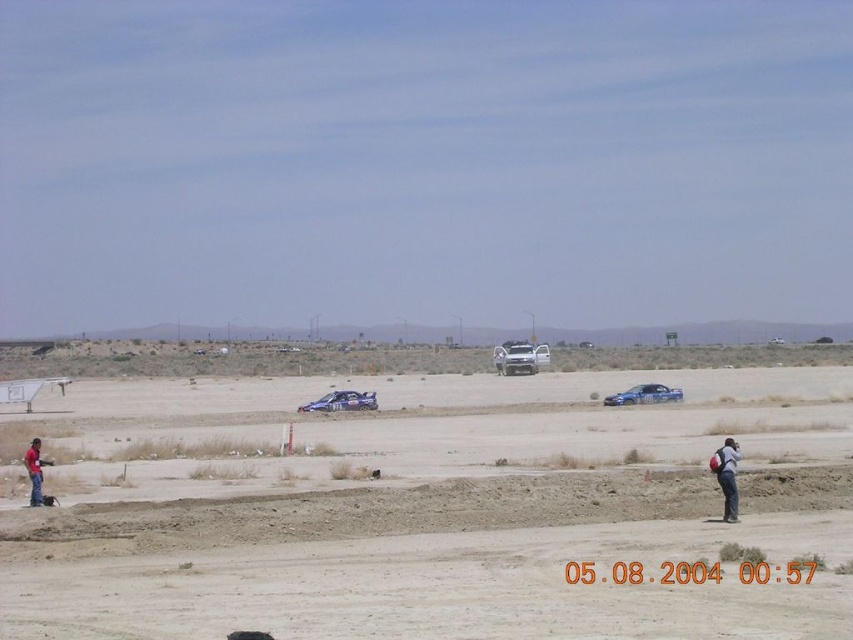
Question: Can you confirm if denim jacket at lower right is positioned below blue metallic car at center?

Choices:
 (A) yes
 (B) no

Answer: (B)

Question: Which is nearer to the white matte car at center?

Choices:
 (A) red shirt at lower left
 (B) blue metallic car at center

Answer: (B)

Question: Among these points, which one is nearest to the camera?

Choices:
 (A) (653, 401)
 (B) (717, 602)
 (C) (33, 484)
 (D) (730, 445)

Answer: (B)

Question: Is dull brown dirt at center positioned before white matte car at center?

Choices:
 (A) no
 (B) yes

Answer: (B)

Question: Is blue metallic car at center thinner than red shirt at lower left?

Choices:
 (A) yes
 (B) no

Answer: (A)

Question: Estimate the real-world distances between objects in this image. Which object is farther from the metallic blue car at center?

Choices:
 (A) white matte car at center
 (B) dull brown dirt at center

Answer: (A)